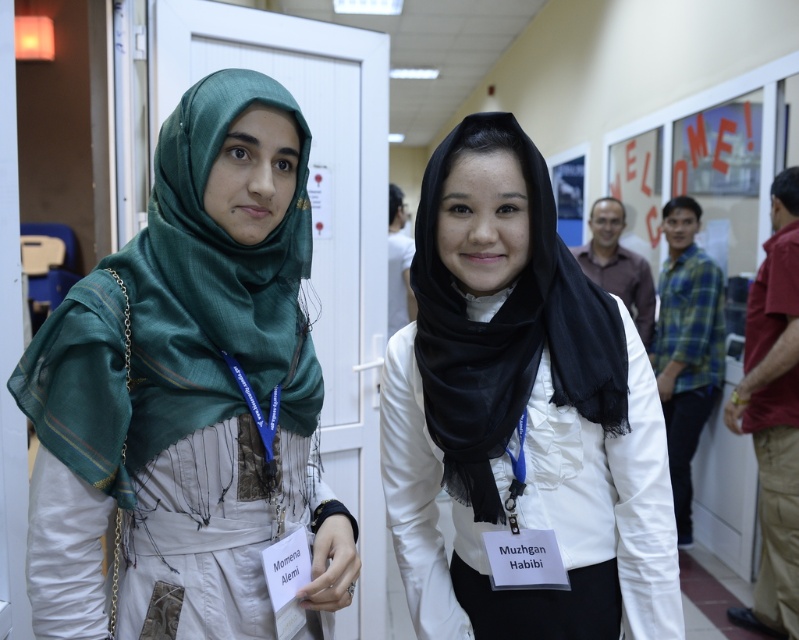
Question: Can you confirm if green silk hijab at left is thinner than black sheer scarf at center?

Choices:
 (A) yes
 (B) no

Answer: (B)

Question: Which point is farther to the camera?

Choices:
 (A) black sheer scarf at center
 (B) green silk hijab at left

Answer: (A)

Question: Observing the image, what is the correct spatial positioning of green silk hijab at left in reference to black sheer scarf at center?

Choices:
 (A) above
 (B) below

Answer: (B)

Question: Does green silk hijab at left appear under black sheer scarf at center?

Choices:
 (A) yes
 (B) no

Answer: (A)

Question: Which of the following is the closest to the observer?

Choices:
 (A) black sheer scarf at center
 (B) green silk hijab at left

Answer: (B)